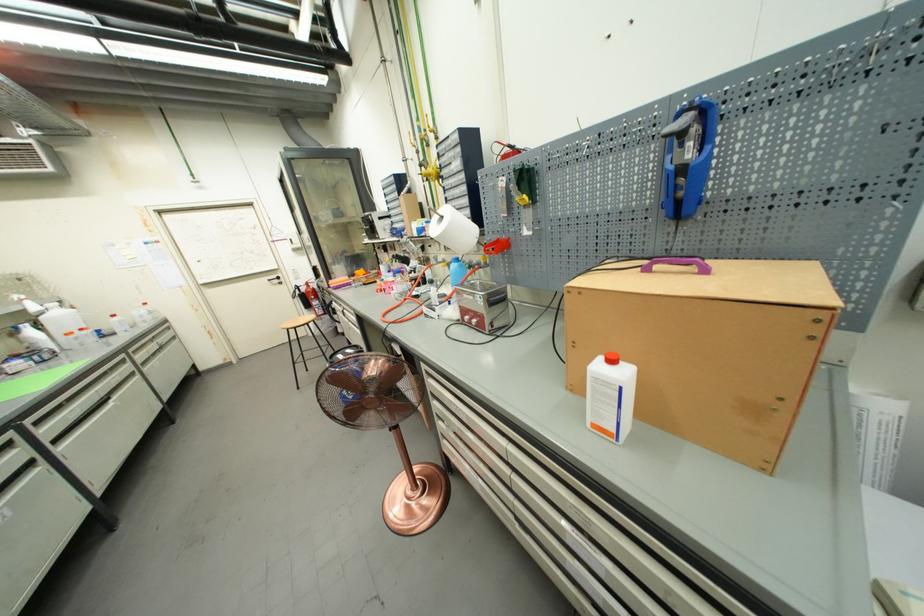
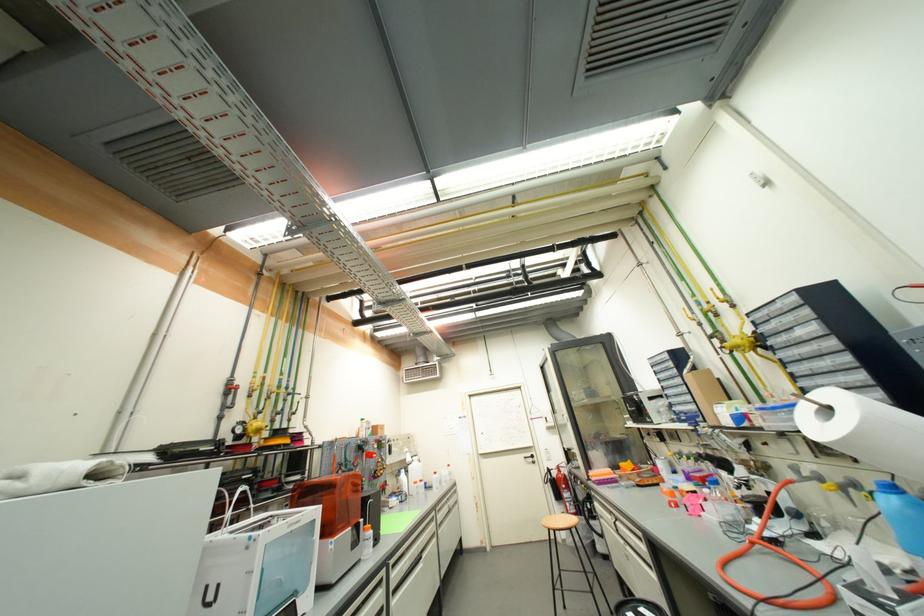
Find the pixel in the second image that matches (424,308) in the first image.

(817, 578)